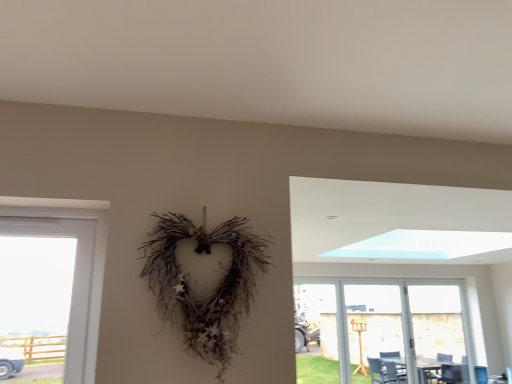
Question: Does point (359, 352) appear closer or farther from the camera than point (458, 331)?

Choices:
 (A) farther
 (B) closer

Answer: (B)

Question: Based on their sizes in the image, would you say transparent plastic screen door at right, marked as the second screen door in a right-to-left arrangement, is bigger or smaller than transparent glass screen door at right, which is the 2th screen door in left-to-right order?

Choices:
 (A) small
 (B) big

Answer: (A)

Question: Which object is positioned closest to the transparent glass screen door at right, which is the 1th screen door from right to left?

Choices:
 (A) transparent glass door at lower right
 (B) transparent plastic screen door at right, the first screen door in the left-to-right sequence

Answer: (A)

Question: Based on their relative distances, which object is nearer to the transparent plastic screen door at right, the first screen door in the left-to-right sequence?

Choices:
 (A) transparent glass screen door at right, which is the 2th screen door in left-to-right order
 (B) transparent glass door at lower right

Answer: (B)